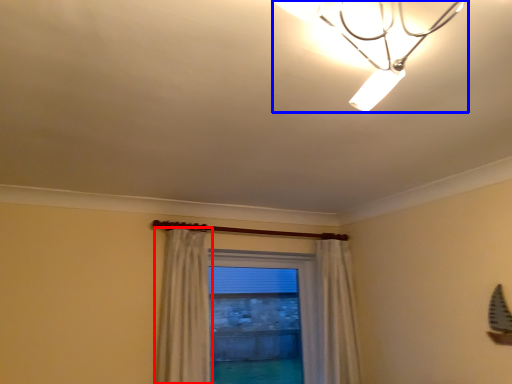
Question: Which of the following is the closest to the observer, curtain (highlighted by a red box) or lamp (highlighted by a blue box)?

Choices:
 (A) curtain
 (B) lamp

Answer: (B)